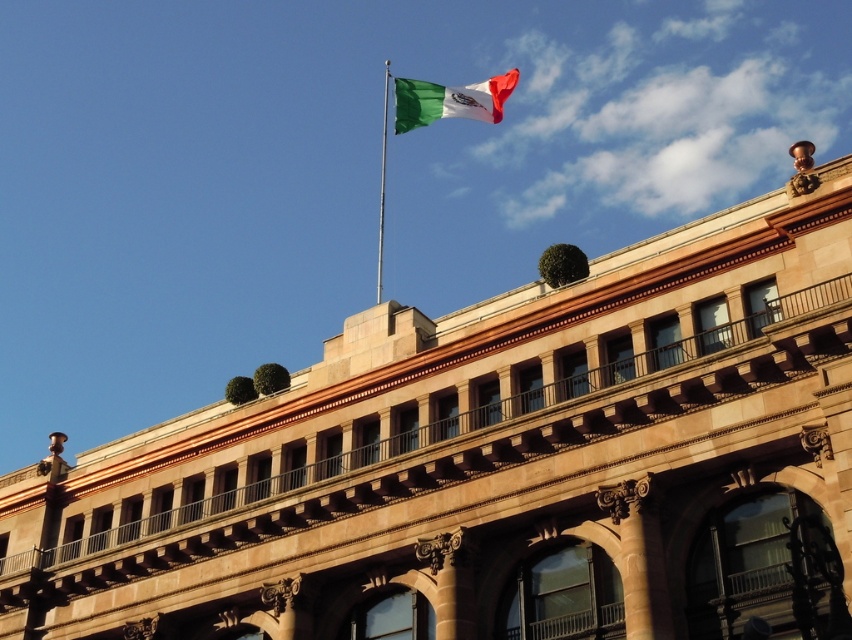
Who is more forward, (429, 116) or (386, 96)?

Point (429, 116) is more forward.

Looking at this image, is green and white fabric flag at upper center wider than silver metallic flag pole at upper center?

Yes, green and white fabric flag at upper center is wider than silver metallic flag pole at upper center.

Between point (499, 112) and point (378, 256), which one is positioned in front?

Point (499, 112) is more forward.

Locate an element on the screen. This screenshot has width=852, height=640. green and white fabric flag at upper center is located at coordinates (450, 100).

Measure the distance between point (509,90) and camera.

They are 67.80 meters apart.

Can you confirm if green and white fabric flag at upper center is wider than metallic pole at upper center?

Correct, the width of green and white fabric flag at upper center exceeds that of metallic pole at upper center.

This screenshot has height=640, width=852. What do you see at coordinates (450, 100) in the screenshot?
I see `green and white fabric flag at upper center` at bounding box center [450, 100].

Identify the location of green and white fabric flag at upper center. Image resolution: width=852 pixels, height=640 pixels. (450, 100).

Measure the distance between metallic pole at upper center and camera.

A distance of 219.19 meters exists between metallic pole at upper center and camera.

Between point (384, 166) and point (383, 120), which one is positioned behind?

Positioned behind is point (383, 120).

Measure the distance between metallic pole at upper center and camera.

metallic pole at upper center and camera are 219.19 meters apart.

I want to click on metallic pole at upper center, so click(x=383, y=182).